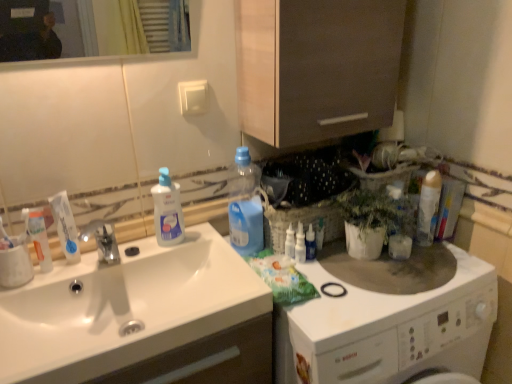
Question: Can clear plastic bottle at sink, which appears as the first cleaning product when viewed from the left, be found inside translucent plastic bottle at upper center, which is the 2th cleaning product from right to left?

Choices:
 (A) no
 (B) yes

Answer: (A)

Question: Is the position of translucent plastic bottle at upper center, which is the 2th cleaning product from right to left, more distant than that of clear plastic bottle at sink, which appears as the first cleaning product when viewed from the left?

Choices:
 (A) no
 (B) yes

Answer: (B)

Question: Is translucent plastic bottle at upper center, which is the 2th cleaning product from right to left, aimed at clear plastic bottle at sink, which appears as the first cleaning product when viewed from the left?

Choices:
 (A) yes
 (B) no

Answer: (B)

Question: Does translucent plastic bottle at upper center, which is the second cleaning product in left-to-right order, touch clear plastic bottle at sink, which ranks as the third cleaning product in right-to-left order?

Choices:
 (A) no
 (B) yes

Answer: (A)

Question: Considering the relative positions of translucent plastic bottle at upper center, which is the second cleaning product in left-to-right order, and clear plastic bottle at sink, which appears as the first cleaning product when viewed from the left, in the image provided, is translucent plastic bottle at upper center, which is the second cleaning product in left-to-right order, to the right of clear plastic bottle at sink, which appears as the first cleaning product when viewed from the left, from the viewer's perspective?

Choices:
 (A) yes
 (B) no

Answer: (A)

Question: Is transparent plastic bottle at upper right in front of or behind white glossy washing machine at right in the image?

Choices:
 (A) behind
 (B) front

Answer: (A)

Question: From a real-world perspective, is transparent plastic bottle at upper right above or below white glossy washing machine at right?

Choices:
 (A) above
 (B) below

Answer: (A)

Question: Would you say transparent plastic bottle at upper right is to the left or to the right of white glossy washing machine at right in the picture?

Choices:
 (A) left
 (B) right

Answer: (A)

Question: From the image's perspective, is transparent plastic bottle at upper right above or below white glossy washing machine at right?

Choices:
 (A) above
 (B) below

Answer: (A)

Question: Is transparent plastic bottle at upper right spatially inside translucent plastic spray bottle at upper right, positioned as the third toiletry in left-to-right order, or outside of it?

Choices:
 (A) inside
 (B) outside

Answer: (B)

Question: Based on their positions, is transparent plastic bottle at upper right located to the left or right of translucent plastic spray bottle at upper right, positioned as the third toiletry in left-to-right order?

Choices:
 (A) left
 (B) right

Answer: (B)

Question: Looking at the image, does transparent plastic bottle at upper right seem bigger or smaller compared to translucent plastic spray bottle at upper right, marked as the 3th toiletry in a back-to-front arrangement?

Choices:
 (A) big
 (B) small

Answer: (A)

Question: In terms of height, does transparent plastic bottle at upper right look taller or shorter compared to translucent plastic spray bottle at upper right, marked as the 3th toiletry in a back-to-front arrangement?

Choices:
 (A) tall
 (B) short

Answer: (B)

Question: Looking at the image, does translucent plastic bottle at upper center, which is the second cleaning product in left-to-right order, seem bigger or smaller compared to white glossy toothpaste at left?

Choices:
 (A) small
 (B) big

Answer: (B)

Question: From the image's perspective, is translucent plastic bottle at upper center, which is the 2th cleaning product from right to left, located above or below white glossy toothpaste at left?

Choices:
 (A) above
 (B) below

Answer: (A)